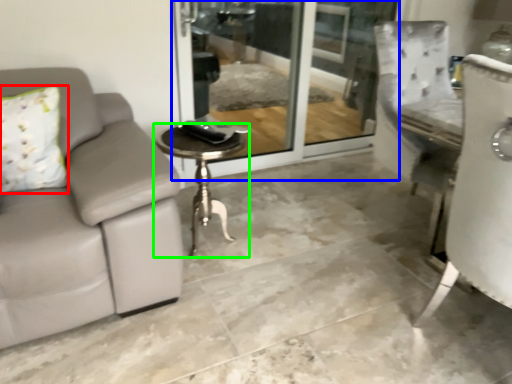
Question: Which object is the closest to the pillow (highlighted by a red box)? Choose among these: screen door (highlighted by a blue box) or table (highlighted by a green box).

Choices:
 (A) screen door
 (B) table

Answer: (B)